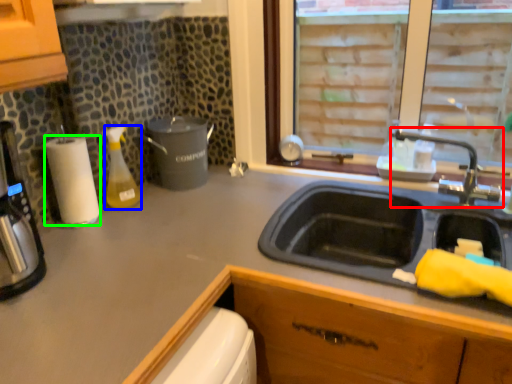
Question: Estimate the real-world distances between objects in this image. Which object is closer to tap (highlighted by a red box), bottle (highlighted by a blue box) or paper towel (highlighted by a green box)?

Choices:
 (A) bottle
 (B) paper towel

Answer: (A)